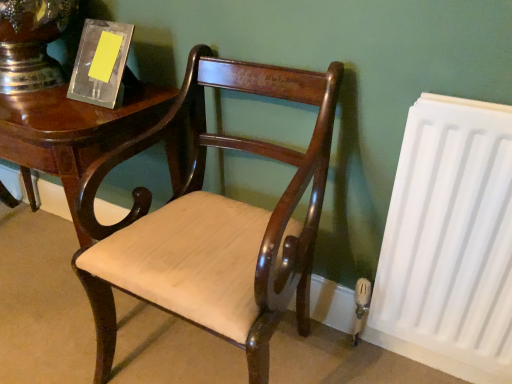
Where is `free spot below shiny dark wood table at left (from a real-world perspective)`? This screenshot has width=512, height=384. free spot below shiny dark wood table at left (from a real-world perspective) is located at coordinates (45, 264).